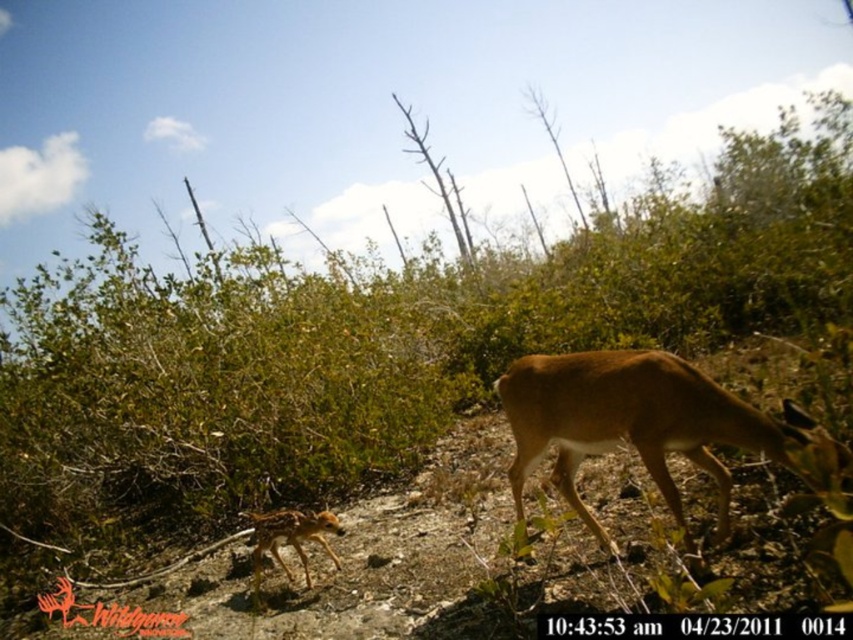
Question: Which point appears closest to the camera in this image?

Choices:
 (A) (651, 468)
 (B) (262, 548)

Answer: (A)

Question: Is brown matte/deer at center positioned in front of spotted fur fawn at lower left?

Choices:
 (A) no
 (B) yes

Answer: (B)

Question: Considering the relative positions of brown matte/deer at center and spotted fur fawn at lower left in the image provided, where is brown matte/deer at center located with respect to spotted fur fawn at lower left?

Choices:
 (A) left
 (B) right

Answer: (B)

Question: Is the position of brown matte/deer at center less distant than that of spotted fur fawn at lower left?

Choices:
 (A) yes
 (B) no

Answer: (A)

Question: Which point is farther from the camera taking this photo?

Choices:
 (A) (561, 461)
 (B) (335, 518)

Answer: (B)